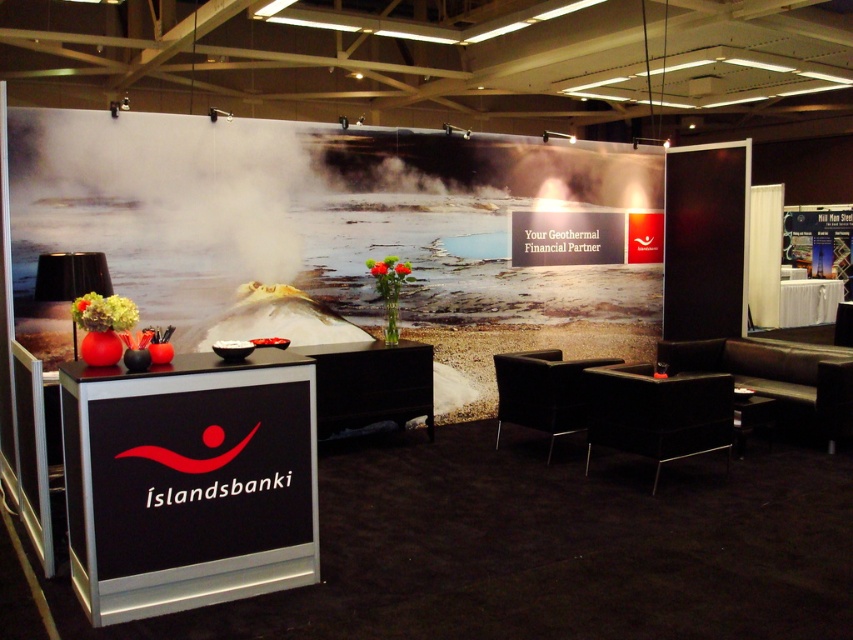
Which is in front, point (703, 451) or point (335, 368)?

Point (703, 451) is more forward.

Is black leather armchair at lower right behind black glossy table at center?

No, it is in front of black glossy table at center.

Which is in front, point (697, 420) or point (366, 388)?

Point (697, 420) is in front.

In order to click on black leather armchair at lower right in this screenshot , I will do `click(657, 412)`.

Is black leather armchair at lower right to the right of dark brown leather armchair at center from the viewer's perspective?

Yes, black leather armchair at lower right is to the right of dark brown leather armchair at center.

Looking at this image, which is below, black leather armchair at lower right or dark brown leather armchair at center?

Positioned lower is black leather armchair at lower right.

Who is more forward, (x=692, y=388) or (x=547, y=365)?

Positioned in front is point (x=692, y=388).

This screenshot has height=640, width=853. What are the coordinates of `black leather armchair at lower right` in the screenshot? It's located at (657, 412).

Does black metallic table at lower left have a greater width compared to dark brown leather armchair at center?

Correct, the width of black metallic table at lower left exceeds that of dark brown leather armchair at center.

Locate an element on the screen. This screenshot has height=640, width=853. black metallic table at lower left is located at coordinates (189, 483).